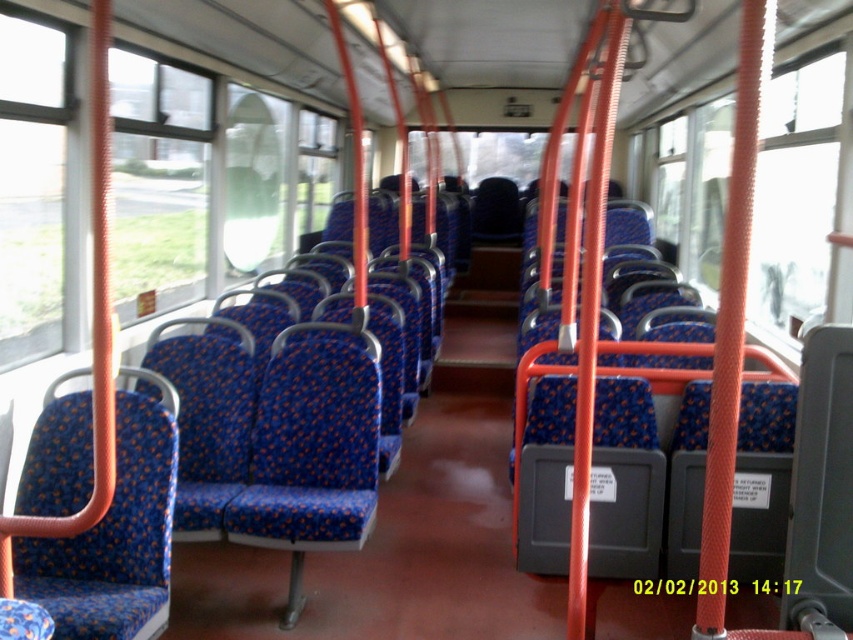
Question: Among these points, which one is farthest from the camera?

Choices:
 (A) click(7, 211)
 (B) click(840, 88)
 (C) click(138, 52)

Answer: (C)

Question: Which object is farther from the camera taking this photo?

Choices:
 (A) transparent glass window at left
 (B) transparent glass window at upper left

Answer: (B)

Question: From the image, what is the correct spatial relationship of transparent glass window at upper left in relation to transparent glass window at left?

Choices:
 (A) above
 (B) below

Answer: (A)

Question: Does transparent glass window at center lie behind transparent glass window at upper left?

Choices:
 (A) no
 (B) yes

Answer: (A)

Question: Which point is closer to the camera?

Choices:
 (A) (180, 125)
 (B) (38, 240)

Answer: (B)

Question: Does transparent glass window at center have a lesser width compared to transparent glass window at upper left?

Choices:
 (A) yes
 (B) no

Answer: (B)